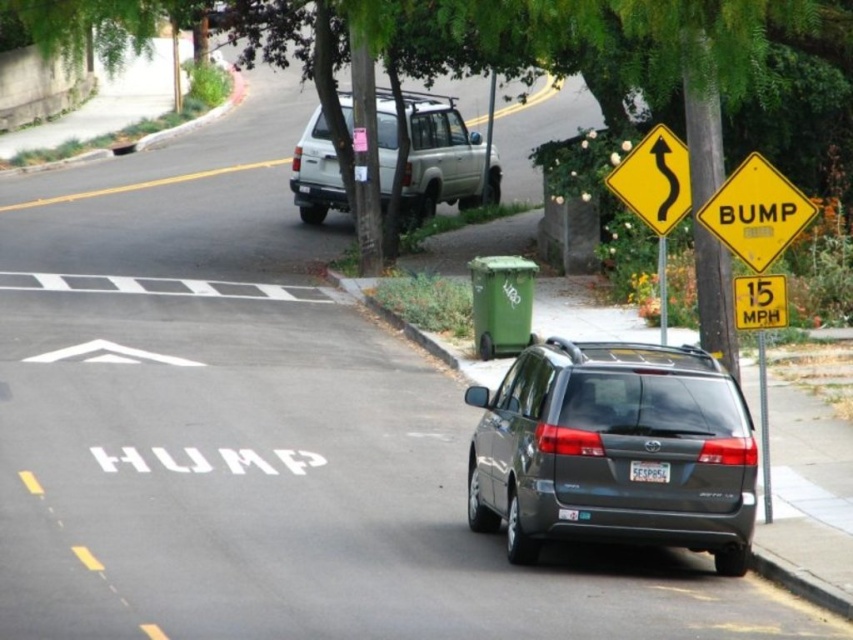
You are standing at the point with coordinates point (x=683, y=189) and want to walk to point (x=294, y=177). Which direction should you face to walk directly towards your destination?

You should face towards the front because point (x=294, y=177) is behind point (x=683, y=189).